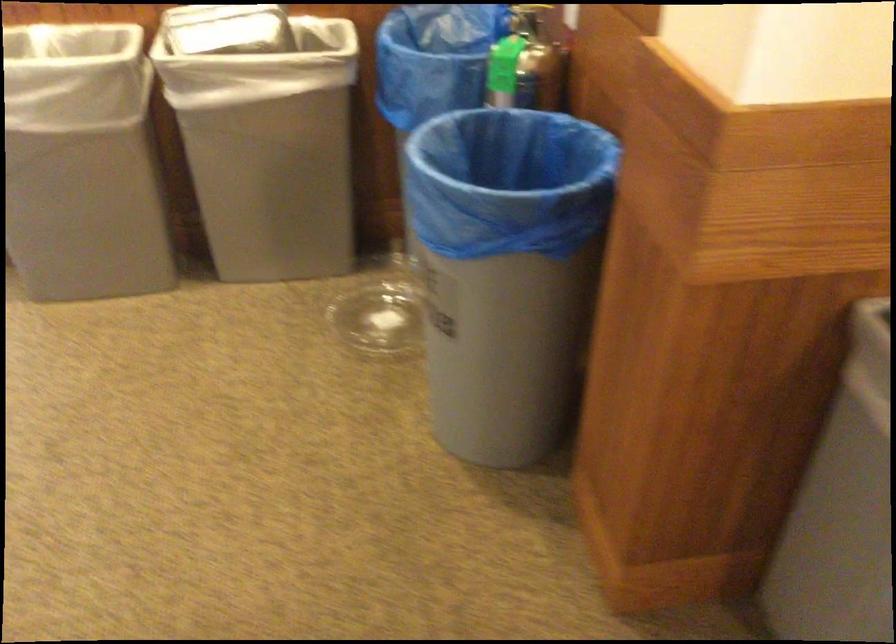
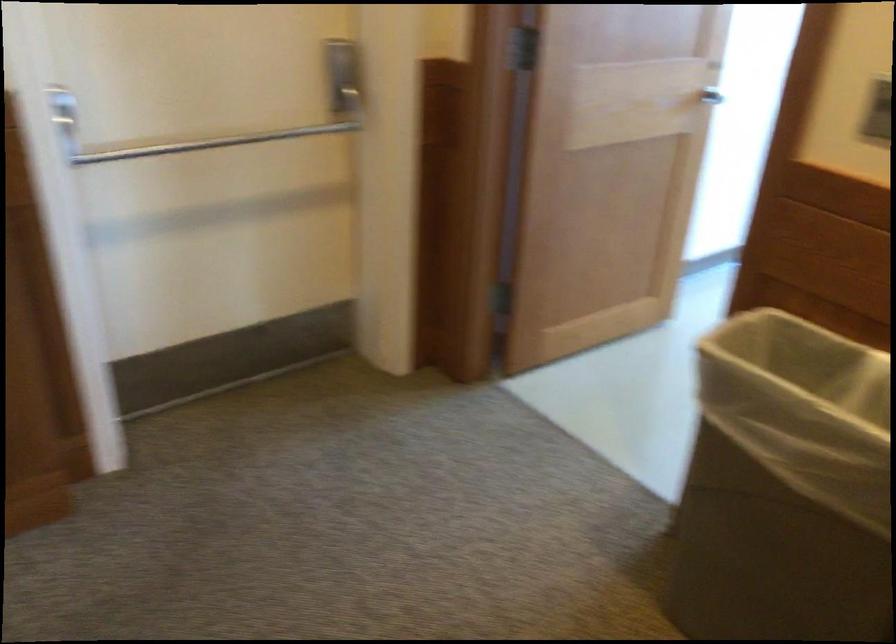
Question: The camera is either moving clockwise (left) or counter-clockwise (right) around the object. The first image is from the beginning of the video and the second image is from the end. Is the camera moving left or right when shooting the video?

Choices:
 (A) Left
 (B) Right

Answer: (B)